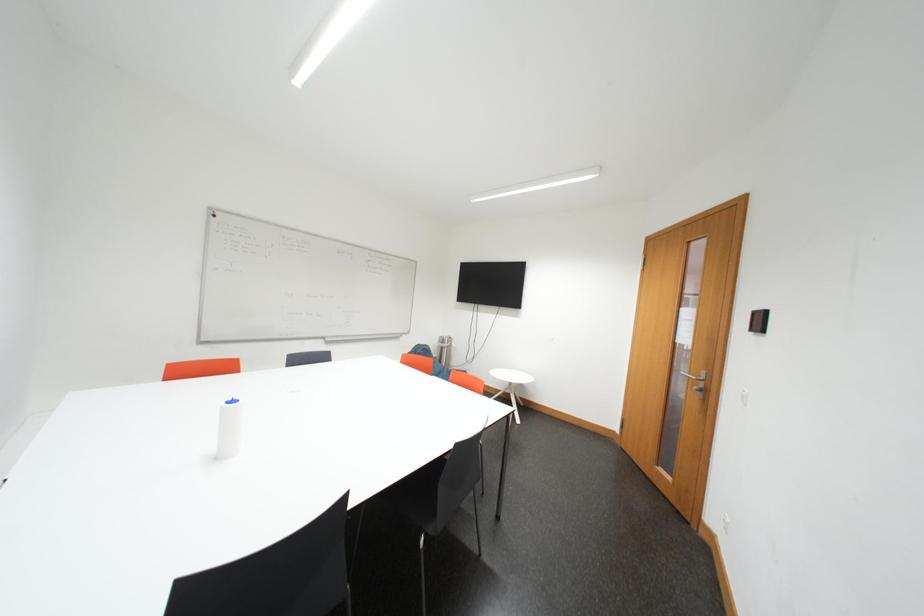
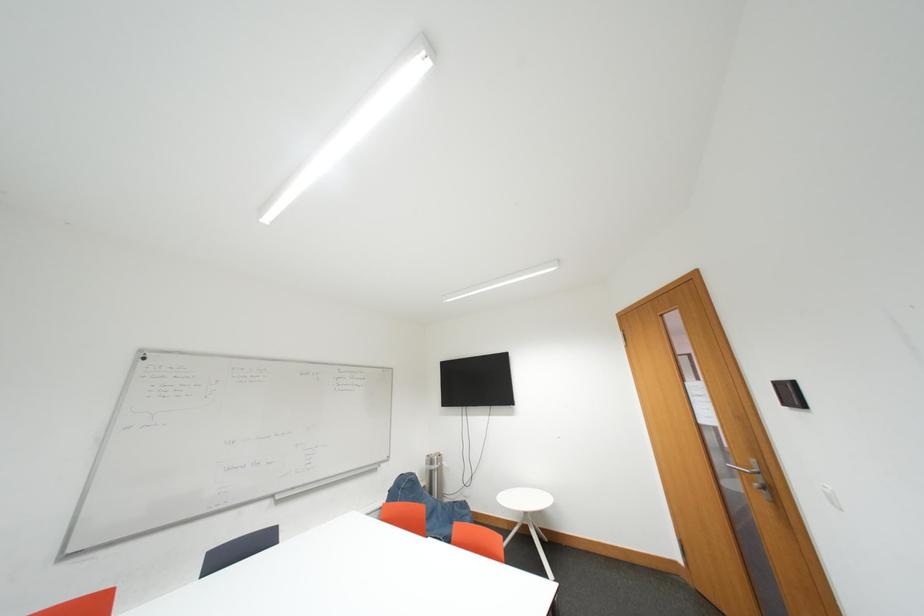
Question: What movement of the cameraman would produce the second image?

Choices:
 (A) Left
 (B) Right
 (C) Forward
 (D) Backward

Answer: (C)